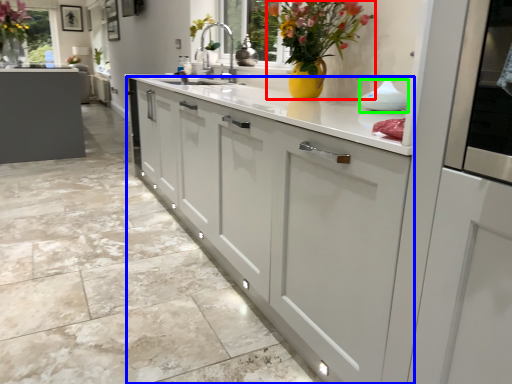
Question: Considering the real-world distances, which object is closest to floral arrangement (highlighted by a red box)? cabinetry (highlighted by a blue box) or appliance (highlighted by a green box).

Choices:
 (A) cabinetry
 (B) appliance

Answer: (B)